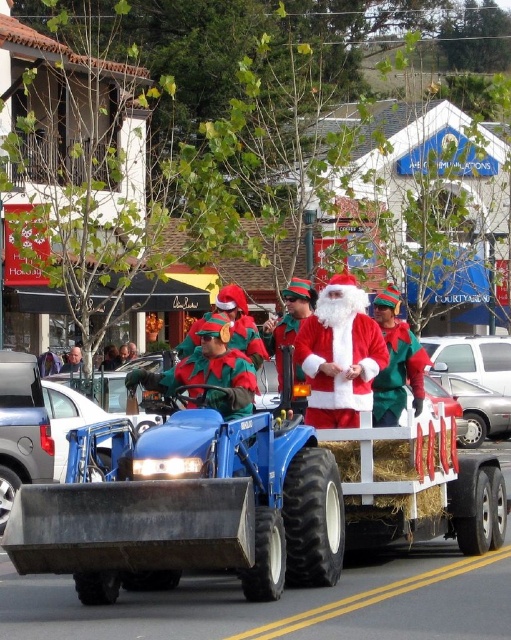
What are the coordinates of the green felt hat at center in the image?

The green felt hat at center is located at coordinates point [397,362].

You are a photographer trying to capture a wide shot of the wooden hay at center and the silver metallic sedan at center. Which object should you focus on to ensure both are fully in frame without cropping?

The wooden hay at center is wider than the silver metallic sedan at center, so focusing on the wider wooden hay at center ensures both objects fit within the frame without cropping.

You are a photographer trying to capture a clear photo of the green felt hat at center without the wooden hay at center blocking it. Based on the scene description, what adjustment should you make to your camera position?

Since the wooden hay at center is in front of the green felt hat at center, you should move your camera position backward to create more distance between the hay and the hat, ensuring the hat is visible without obstruction.